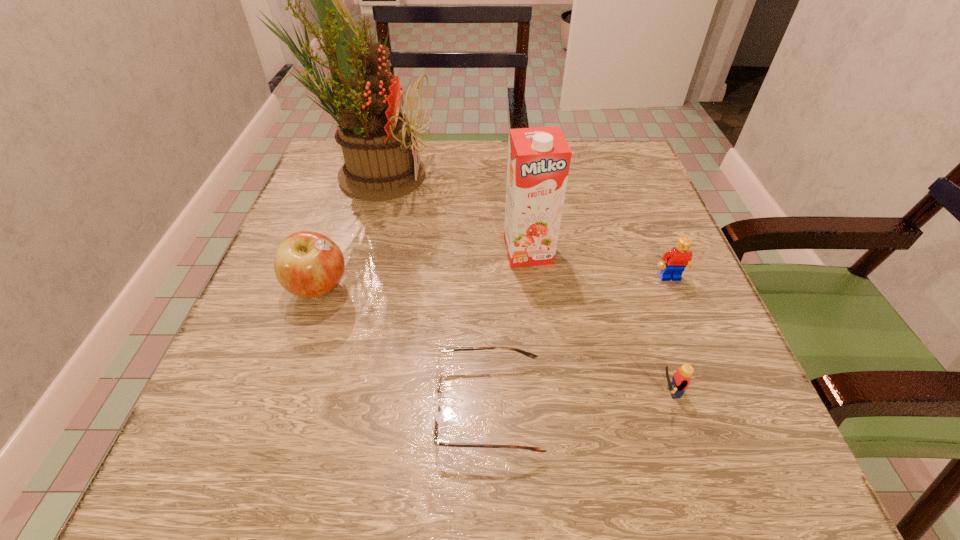
Identify the location of the tallest object. The image size is (960, 540). (376, 138).

At what (x,y) coordinates should I click in order to perform the action: click on flower arrangement. Please return your answer as a coordinate pair (x, y). This screenshot has width=960, height=540. Looking at the image, I should click on (376, 138).

Locate an element on the screen. carton is located at coordinates (539, 158).

This screenshot has width=960, height=540. Find the location of `apple`. apple is located at coordinates (307, 264).

Where is `the farther Lego`? The width and height of the screenshot is (960, 540). the farther Lego is located at coordinates (678, 258).

Locate an element on the screen. This screenshot has width=960, height=540. the rightmost object is located at coordinates (678, 258).

This screenshot has width=960, height=540. I want to click on the fifth object from left to right, so click(681, 378).

You are a GUI agent. You are given a task and a screenshot of the screen. Output one action in this format:
    pyautogui.click(x=<x>, y=<y>)
    Task: Click on the left Lego
    
    Given the screenshot: What is the action you would take?
    pyautogui.click(x=681, y=378)

This screenshot has width=960, height=540. In order to click on spectacles in this screenshot , I will do point(436,410).

In order to click on vacant space situated 0.070m in front of the farthest object with the fan visible in this screenshot , I will do `click(463, 174)`.